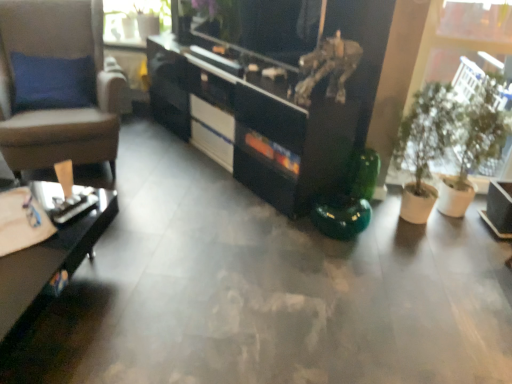
Question: Could you tell me if black glossy desk at lower left is turned towards black glossy cabinet at center?

Choices:
 (A) no
 (B) yes

Answer: (A)

Question: From a real-world perspective, is black glossy desk at lower left positioned over black glossy cabinet at center based on gravity?

Choices:
 (A) no
 (B) yes

Answer: (A)

Question: Considering the relative sizes of black glossy desk at lower left and black glossy cabinet at center in the image provided, is black glossy desk at lower left taller than black glossy cabinet at center?

Choices:
 (A) yes
 (B) no

Answer: (B)

Question: Does black glossy desk at lower left appear on the left side of black glossy cabinet at center?

Choices:
 (A) yes
 (B) no

Answer: (A)

Question: Is black glossy cabinet at center surrounded by black glossy desk at lower left?

Choices:
 (A) no
 (B) yes

Answer: (A)

Question: Is black glossy desk at lower left positioned beyond the bounds of black glossy cabinet at center?

Choices:
 (A) no
 (B) yes

Answer: (B)

Question: Is clear glass vase at upper left in front of green matte plant at right?

Choices:
 (A) no
 (B) yes

Answer: (A)

Question: Does clear glass vase at upper left have a greater height compared to green matte plant at right?

Choices:
 (A) no
 (B) yes

Answer: (A)

Question: Does clear glass vase at upper left contain green matte plant at right?

Choices:
 (A) no
 (B) yes

Answer: (A)

Question: Considering the relative sizes of clear glass vase at upper left and green matte plant at right in the image provided, is clear glass vase at upper left shorter than green matte plant at right?

Choices:
 (A) no
 (B) yes

Answer: (B)

Question: From a real-world perspective, is clear glass vase at upper left under green matte plant at right?

Choices:
 (A) no
 (B) yes

Answer: (A)

Question: Does clear glass vase at upper left come behind green matte plant at right?

Choices:
 (A) yes
 (B) no

Answer: (A)

Question: Is white glossy drawer at center thinner than black glossy desk at lower left?

Choices:
 (A) no
 (B) yes

Answer: (B)